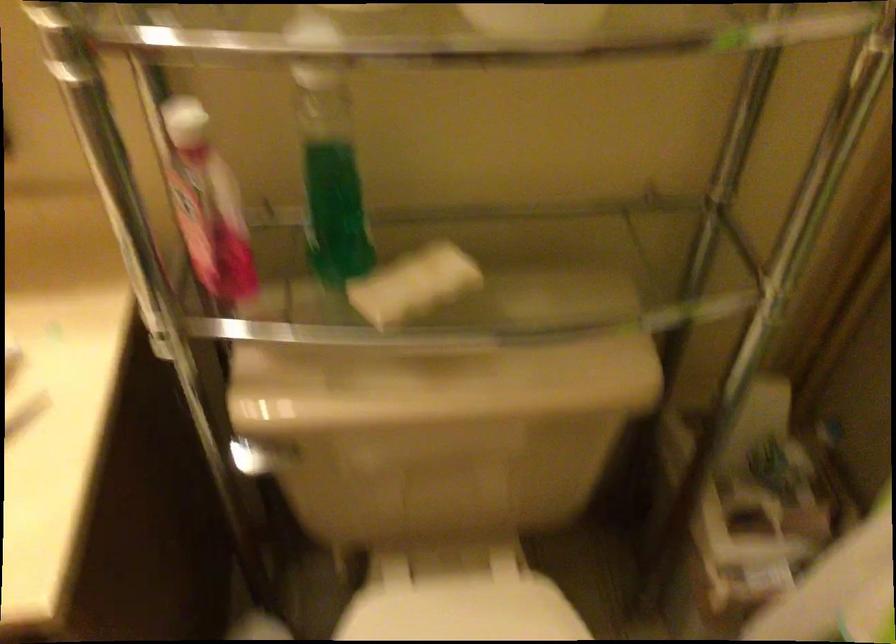
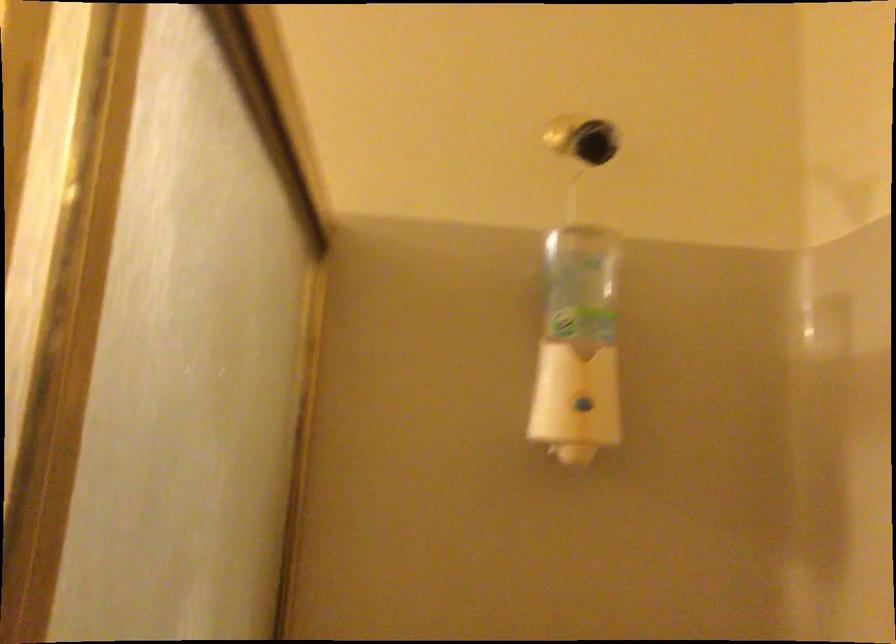
Question: Based on the continuous images, in which direction is the camera rotating? Reply with the corresponding letter.

Choices:
 (A) Left
 (B) Right
 (C) Up
 (D) Down

Answer: (C)